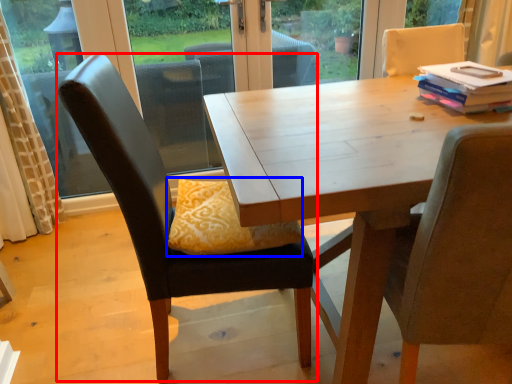
Question: Which of the following is the closest to the observer, chair (highlighted by a red box) or pillow (highlighted by a blue box)?

Choices:
 (A) chair
 (B) pillow

Answer: (A)